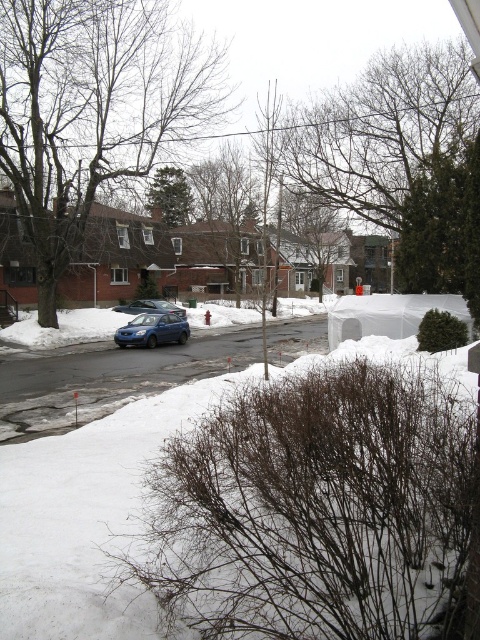
Question: Is white fluffy snow at lower left above matte blue van at center?

Choices:
 (A) no
 (B) yes

Answer: (A)

Question: Is white fluffy snow at lower left in front of matte blue van at center?

Choices:
 (A) no
 (B) yes

Answer: (B)

Question: Which point is farther from the camera taking this photo?

Choices:
 (A) (226, 396)
 (B) (118, 310)
 (C) (121, 337)

Answer: (B)

Question: Which point is farther from the camera taking this photo?

Choices:
 (A) (132, 310)
 (B) (178, 333)

Answer: (A)

Question: Among these objects, which one is farthest from the camera?

Choices:
 (A) satin blue sedan at center
 (B) matte blue van at center
 (C) white fluffy snow at lower left

Answer: (A)

Question: From the image, what is the correct spatial relationship of white fluffy snow at lower left in relation to satin blue sedan at center?

Choices:
 (A) below
 (B) above

Answer: (A)